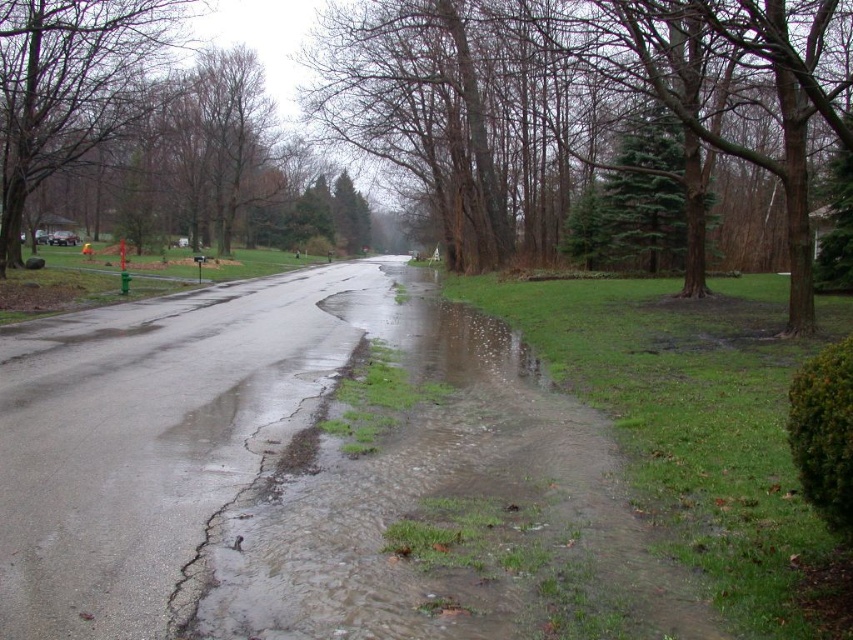
Is green textured tree at center to the right of green leafy tree at upper left from the viewer's perspective?

Indeed, green textured tree at center is positioned on the right side of green leafy tree at upper left.

Does green textured tree at center have a lesser height compared to green leafy tree at upper left?

No.

What are the coordinates of `green textured tree at center` in the screenshot? It's located at (575, 104).

Can you confirm if clear water at lower center is thinner than green textured tree at center?

Yes.

Is clear water at lower center to the right of green textured tree at center from the viewer's perspective?

No, clear water at lower center is not to the right of green textured tree at center.

Where is `clear water at lower center`? This screenshot has width=853, height=640. clear water at lower center is located at coordinates (445, 499).

Who is shorter, clear water at lower center or green leafy tree at upper left?

clear water at lower center is shorter.

Does point (387, 518) come farther from viewer compared to point (32, 52)?

No, (387, 518) is closer to viewer.

At what (x,y) coordinates should I click in order to perform the action: click on clear water at lower center. Please return your answer as a coordinate pair (x, y). The image size is (853, 640). Looking at the image, I should click on (445, 499).